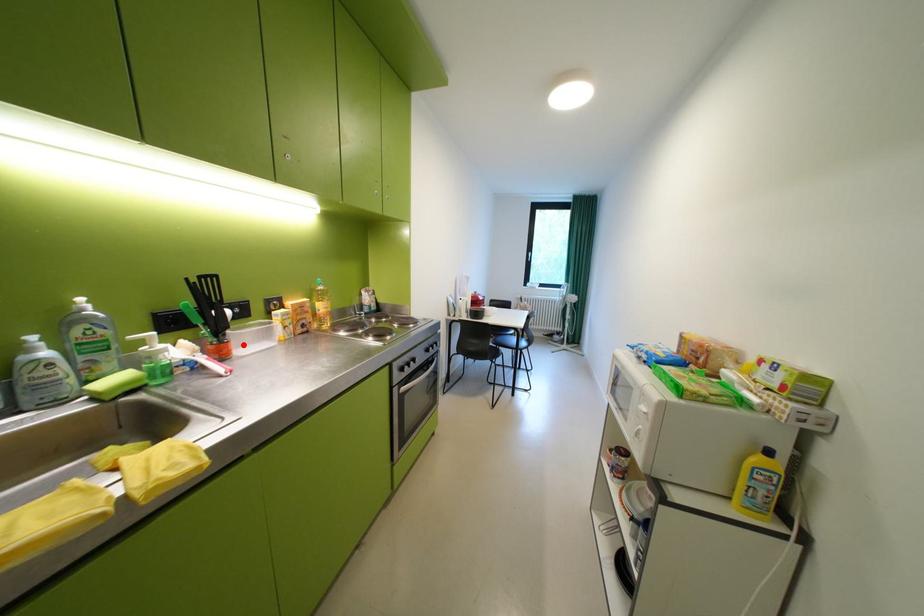
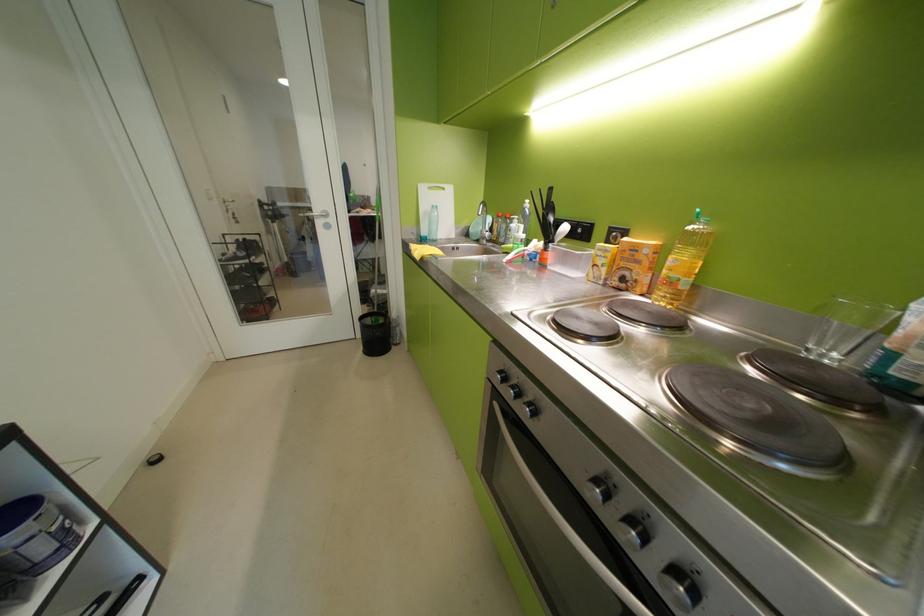
The point at the highlighted location is marked in the first image. Where is the corresponding point in the second image?

(561, 256)